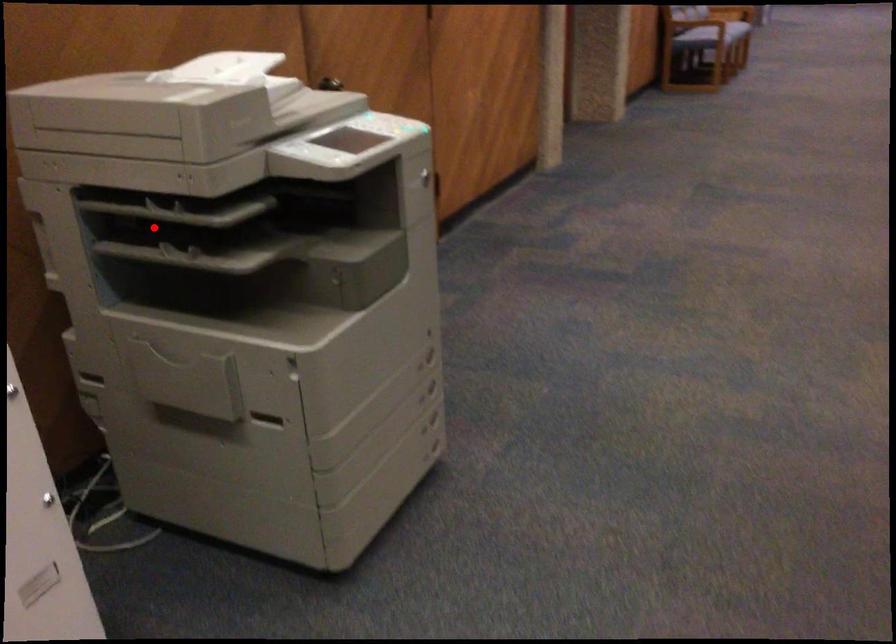
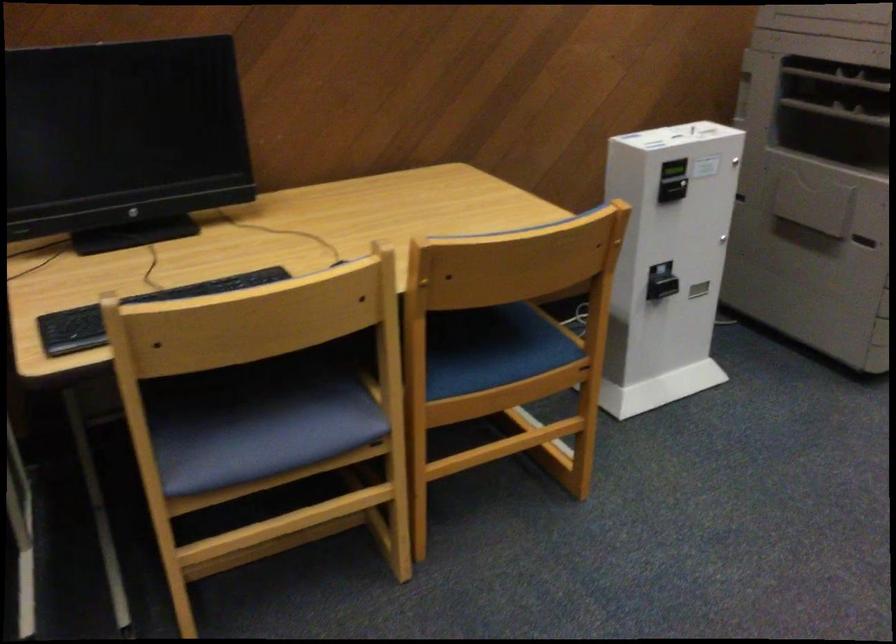
Question: I am providing you with two images of the same scene from different viewpoints. In image1, a red point is highlighted. Considering the same 3D point in image2, which of the following is correct?

Choices:
 (A) It is closer
 (B) It is farther

Answer: (B)